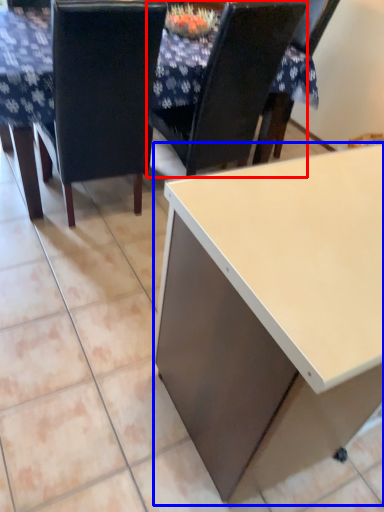
Question: Which object appears farthest to the camera in this image, chair (highlighted by a red box) or desk (highlighted by a blue box)?

Choices:
 (A) chair
 (B) desk

Answer: (A)